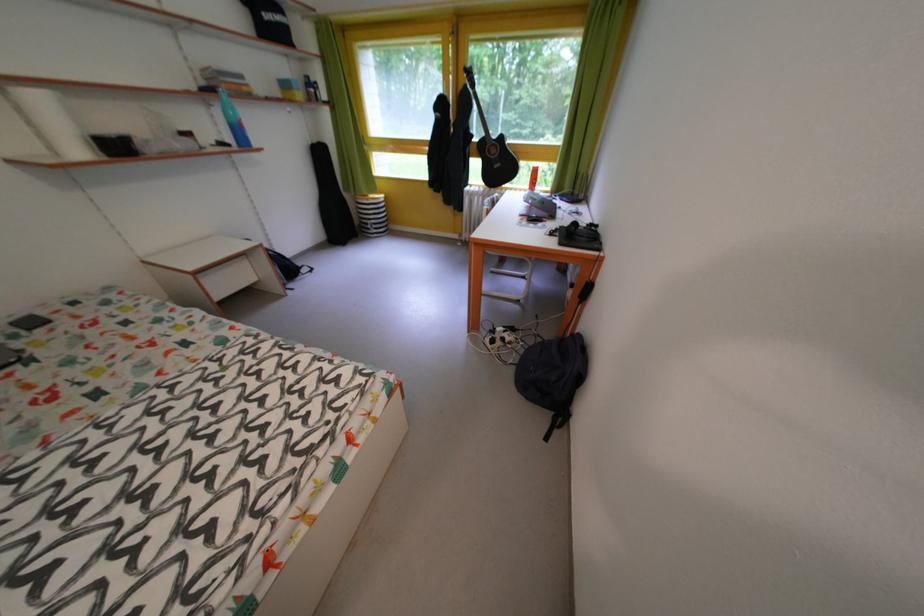
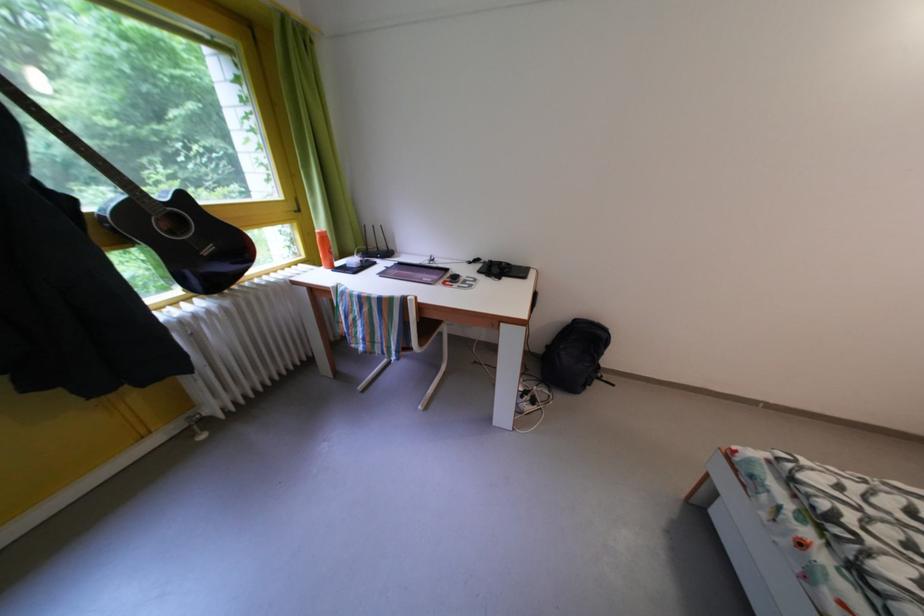
In the second image, find the point that corresponds to (x=512, y=143) in the first image.

(191, 203)